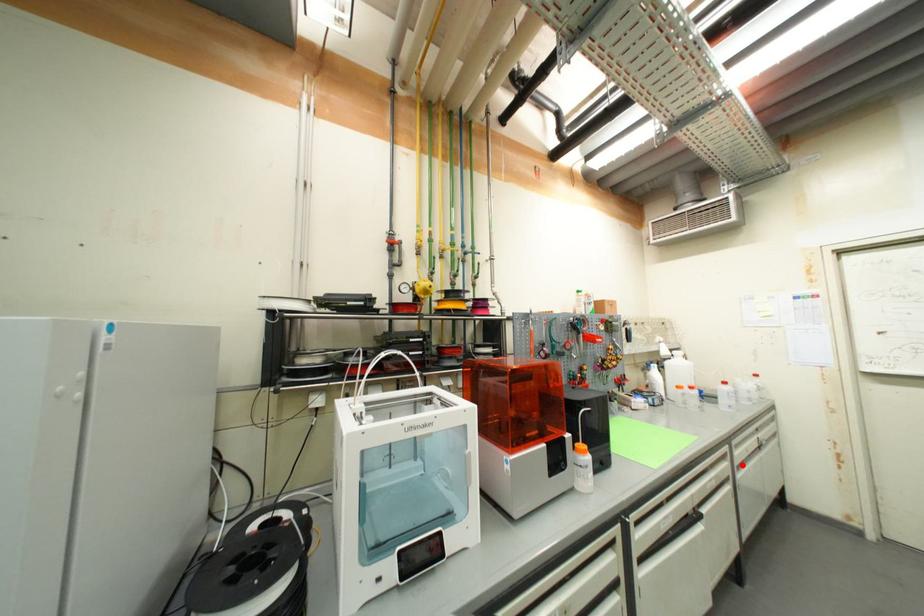
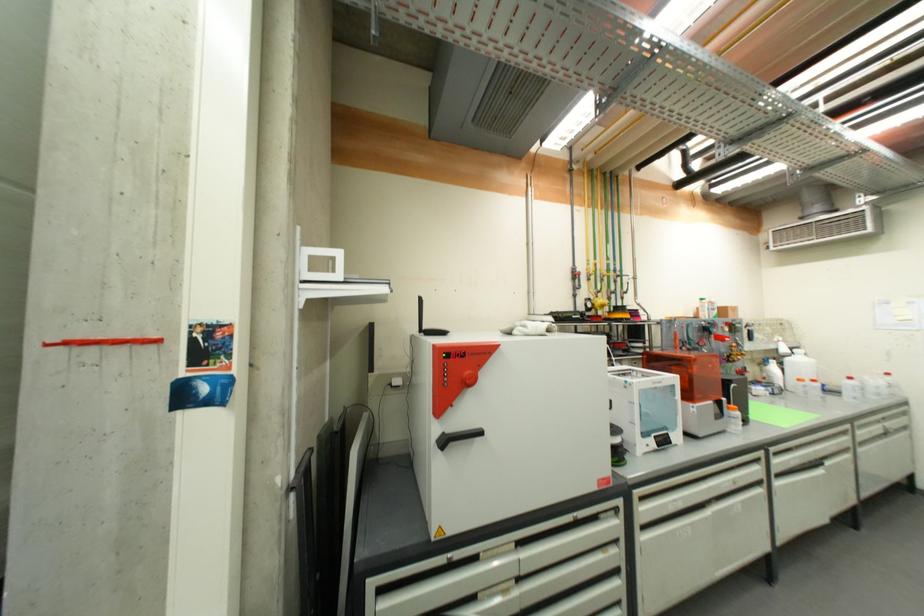
Question: A red point is marked in image1. In image2, is the corresponding 3D point closer to the camera or farther? Reply with the corresponding letter.

Choices:
 (A) The corresponding 3D point is closer.
 (B) The corresponding 3D point is farther.

Answer: (A)